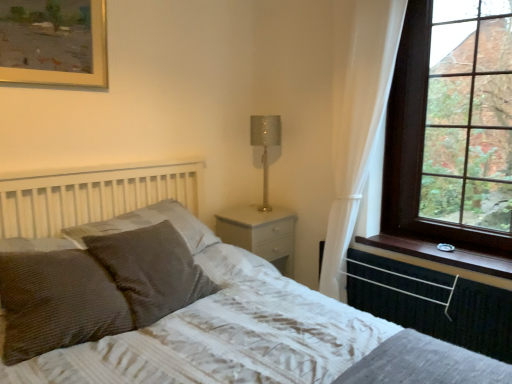
Question: Is textured gray bed at center bigger or smaller than brown wood window sill at right?

Choices:
 (A) big
 (B) small

Answer: (A)

Question: Is point (232, 355) positioned closer to the camera than point (459, 248)?

Choices:
 (A) farther
 (B) closer

Answer: (B)

Question: Which is farther from the brown wood window sill at right?

Choices:
 (A) brown wooden window at upper right
 (B) black rubber radiator at lower right
 (C) brown textured pillow at lower left, the third pillow when ordered from back to front
 (D) white sheer curtain at right
 (E) brown textured pillow at center, which is counted as the second pillow, starting from the front

Answer: (C)

Question: Estimate the real-world distances between objects in this image. Which object is closer to the brown textured pillow at center, which is counted as the second pillow, starting from the front?

Choices:
 (A) black rubber radiator at lower right
 (B) brown wood window sill at right
 (C) white glossy nightstand at center
 (D) textured gray bed at center
 (E) brown textured pillow at lower left, which ranks as the 1th pillow in front-to-back order

Answer: (E)